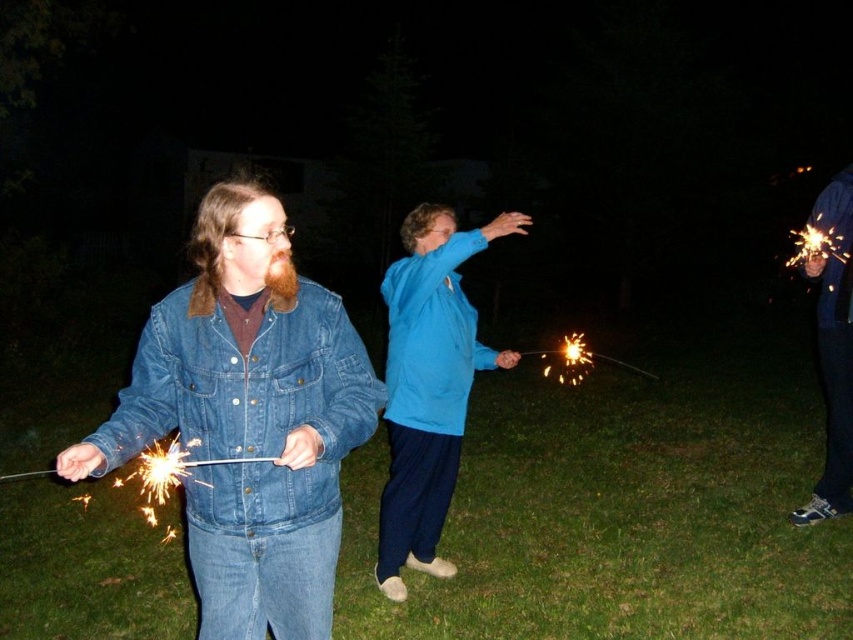
Question: Which of the following is the closest to the observer?

Choices:
 (A) denim jacket at right
 (B) denim jacket at left
 (C) blue fabric jacket at center

Answer: (B)

Question: Is denim jacket at left wider than denim jacket at right?

Choices:
 (A) no
 (B) yes

Answer: (B)

Question: Which point is farther to the camera?

Choices:
 (A) denim jacket at right
 (B) denim jacket at left

Answer: (A)

Question: Which of these objects is positioned closest to the denim jacket at left?

Choices:
 (A) blue fabric jacket at center
 (B) denim jacket at right

Answer: (A)

Question: Is blue fabric jacket at center wider than denim jacket at right?

Choices:
 (A) no
 (B) yes

Answer: (B)

Question: Does denim jacket at left appear under blue fabric jacket at center?

Choices:
 (A) no
 (B) yes

Answer: (B)